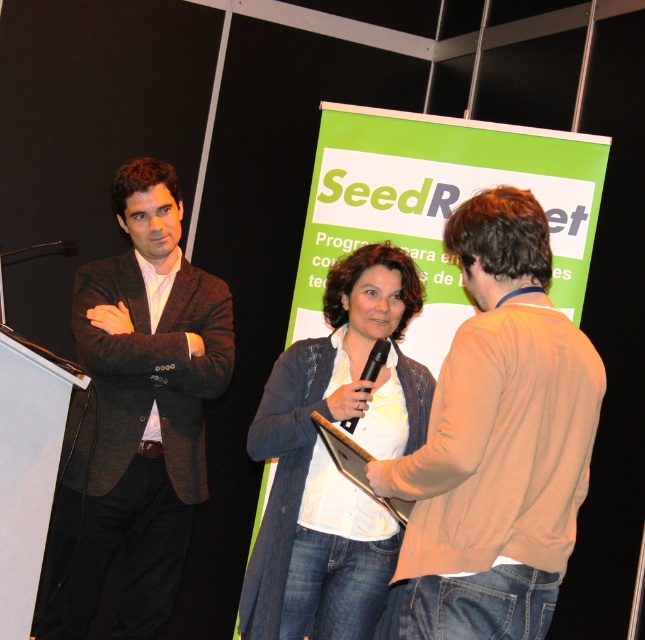
Looking at this image, you are at the event and need to hand out a gift to both the person in the dark gray suit at left and the white knitwear at center. If you want to give the gifts to both without moving from your current position, which person should you hand the gift to first based on their height?

The dark gray suit at left is much taller than the white knitwear at center, so you should hand the gift to the dark gray suit at left first as they are taller and can reach the gift more easily from your current position.

You are attending the SeedR event and need to find a space to sit between the dark gray suit at left and the white knitwear at center. If the available bench is 1.2 meters wide, will there be enough space for both of them to sit comfortably?

The dark gray suit at left might be wider than white knitwear at center, so it is uncertain if the 1.2 meter bench can accommodate both. Check the actual width of each before deciding.